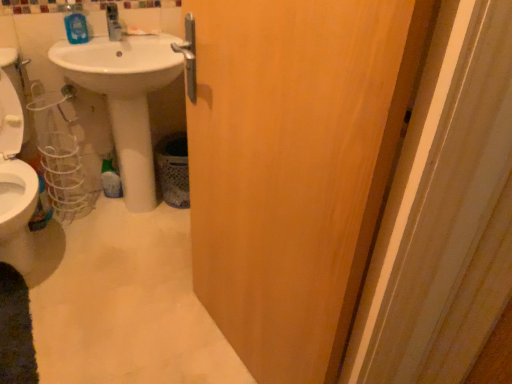
This screenshot has height=384, width=512. In order to click on wooden door at center in this screenshot , I will do `click(294, 167)`.

You are a GUI agent. You are given a task and a screenshot of the screen. Output one action in this format:
    pyautogui.click(x=<x>, y=<y>)
    Task: Click on the white glossy sink at center
    
    Given the screenshot: What is the action you would take?
    pyautogui.click(x=131, y=95)

Which of these two, blue glossy mouthwash at upper left or white glossy sink at center, is bigger?

Bigger between the two is white glossy sink at center.

In order to click on sink lying in front of the blue glossy mouthwash at upper left in this screenshot , I will do `click(131, 95)`.

Is blue glossy mouthwash at upper left oriented towards white glossy sink at center?

Yes, blue glossy mouthwash at upper left is turned towards white glossy sink at center.

From a real-world perspective, is blue glossy mouthwash at upper left positioned above or below white glossy sink at center?

blue glossy mouthwash at upper left is above white glossy sink at center.

Between white glossy sink at center and blue glossy mouthwash at upper left, which one has less height?

blue glossy mouthwash at upper left is shorter.

Considering the positions of objects white glossy sink at center and blue glossy mouthwash at upper left in the image provided, who is more to the left, white glossy sink at center or blue glossy mouthwash at upper left?

blue glossy mouthwash at upper left.

Which is further, [139,127] or [81,34]?

The point [139,127] is farther from the camera.

Is white glossy sink at center oriented away from blue glossy mouthwash at upper left?

Yes, white glossy sink at center is positioned with its back facing blue glossy mouthwash at upper left.

Can you confirm if wooden door at center is shorter than blue glossy mouthwash at upper left?

In fact, wooden door at center may be taller than blue glossy mouthwash at upper left.

What are the coordinates of `door that appears below the blue glossy mouthwash at upper left (from a real-world perspective)` in the screenshot? It's located at (294, 167).

Is wooden door at center bigger than blue glossy mouthwash at upper left?

Indeed, wooden door at center has a larger size compared to blue glossy mouthwash at upper left.

Is blue glossy mouthwash at upper left inside wooden door at center?

No, blue glossy mouthwash at upper left is not inside wooden door at center.

From a real-world perspective, is blue glossy mouthwash at upper left above or below wooden door at center?

blue glossy mouthwash at upper left is situated higher than wooden door at center in the real world.

How many degrees apart are the facing directions of blue glossy mouthwash at upper left and wooden door at center?

blue glossy mouthwash at upper left and wooden door at center are facing 85 degrees away from each other.

Which is more to the right, blue glossy mouthwash at upper left or wooden door at center?

wooden door at center is more to the right.

Which of these two, blue glossy mouthwash at upper left or wooden door at center, is thinner?

With smaller width is blue glossy mouthwash at upper left.

Considering the sizes of objects wooden door at center and white glossy sink at center in the image provided, who is bigger, wooden door at center or white glossy sink at center?

With larger size is white glossy sink at center.

Identify the location of door in front of the white glossy sink at center. (294, 167).

Would you say wooden door at center is inside or outside white glossy sink at center?

wooden door at center lies outside white glossy sink at center.

Is wooden door at center shorter than white glossy sink at center?

No, wooden door at center is not shorter than white glossy sink at center.

Is white glossy sink at center not near wooden door at center?

→ Actually, white glossy sink at center and wooden door at center are a little close together.

From a real-world perspective, who is located lower, white glossy sink at center or wooden door at center?

white glossy sink at center is physically lower.

I want to click on sink above the wooden door at center (from the image's perspective), so click(x=131, y=95).

Consider the image. Considering the sizes of objects white glossy sink at center and wooden door at center in the image provided, who is shorter, white glossy sink at center or wooden door at center?

white glossy sink at center.

Where is `sink located below the blue glossy mouthwash at upper left (from the image's perspective)`? This screenshot has width=512, height=384. sink located below the blue glossy mouthwash at upper left (from the image's perspective) is located at coordinates (131, 95).

Identify the location of sink that is in front of the blue glossy mouthwash at upper left. This screenshot has width=512, height=384. (131, 95).

Considering their positions, is wooden door at center positioned further to white glossy sink at center than blue glossy mouthwash at upper left?

wooden door at center.

From the image, which object appears to be farther from wooden door at center, blue glossy mouthwash at upper left or white glossy sink at center?

The object further to wooden door at center is blue glossy mouthwash at upper left.

From the image, which object appears to be farther from wooden door at center, white glossy sink at center or blue glossy mouthwash at upper left?

blue glossy mouthwash at upper left.

Estimate the real-world distances between objects in this image. Which object is further from blue glossy mouthwash at upper left, white glossy sink at center or wooden door at center?

wooden door at center is further to blue glossy mouthwash at upper left.

Considering their positions, is wooden door at center positioned further to blue glossy mouthwash at upper left than white glossy sink at center?

Among the two, wooden door at center is located further to blue glossy mouthwash at upper left.

Looking at the image, which one is located closer to white glossy sink at center, blue glossy mouthwash at upper left or wooden door at center?

blue glossy mouthwash at upper left is positioned closer to the anchor white glossy sink at center.

At what (x,y) coordinates should I click in order to perform the action: click on sink positioned between wooden door at center and blue glossy mouthwash at upper left from near to far. Please return your answer as a coordinate pair (x, y). The height and width of the screenshot is (384, 512). Looking at the image, I should click on (131, 95).